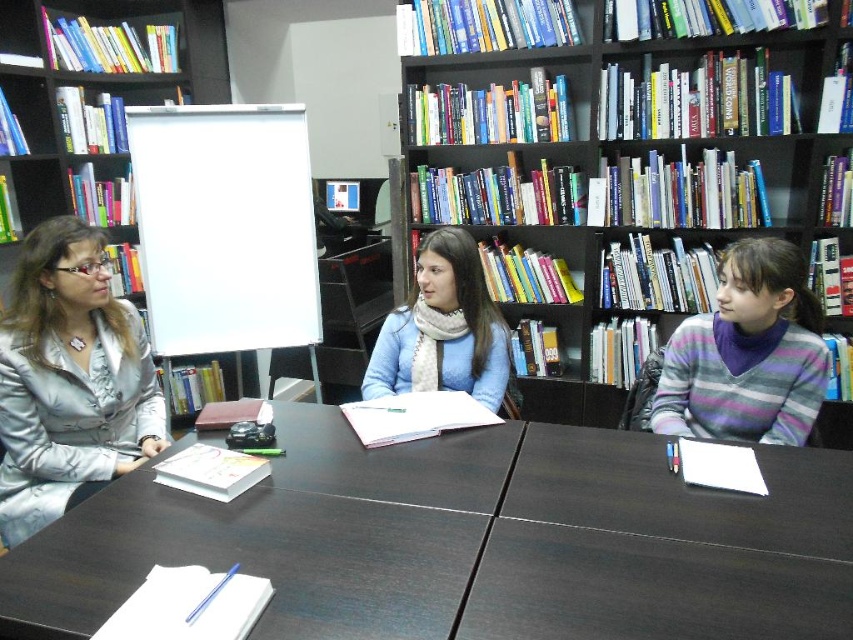
Question: Can you confirm if black matte bookcase at upper center is positioned above blue scarf at center?

Choices:
 (A) no
 (B) yes

Answer: (B)

Question: Estimate the real-world distances between objects in this image. Which object is farther from the multicolored wooden bookcase at upper center?

Choices:
 (A) blue scarf at center
 (B) matte silver blazer at left
 (C) dark wood table at center

Answer: (C)

Question: Is matte silver blazer at left positioned in front of striped sweater at right?

Choices:
 (A) yes
 (B) no

Answer: (B)

Question: Which of the following is the farthest from the observer?

Choices:
 (A) matte silver blazer at left
 (B) black matte bookcase at upper center
 (C) striped sweater at right

Answer: (B)

Question: Does black matte bookcase at upper center have a larger size compared to matte silver blazer at left?

Choices:
 (A) yes
 (B) no

Answer: (A)

Question: Which point is closer to the camera?

Choices:
 (A) (450, 310)
 (B) (793, 368)
 (C) (56, 1)
 (D) (819, 636)

Answer: (D)